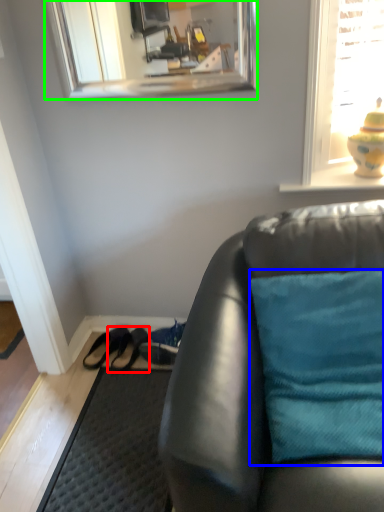
Question: Which object is positioned farthest from shoe (highlighted by a red box)? Select from pillow (highlighted by a blue box) and mirror (highlighted by a green box).

Choices:
 (A) pillow
 (B) mirror

Answer: (B)